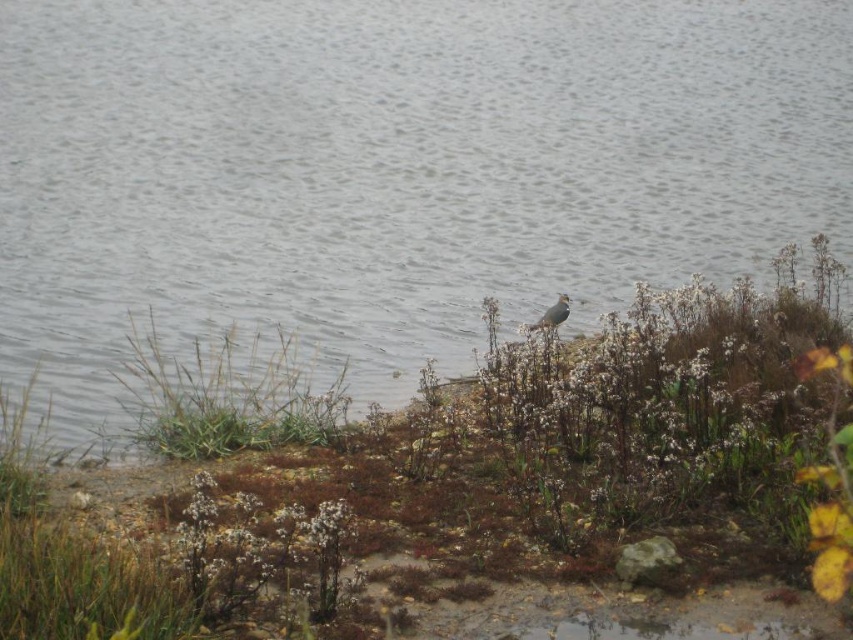
Question: Can you confirm if gray water at center is smaller than gray matte bird at center?

Choices:
 (A) no
 (B) yes

Answer: (A)

Question: Which object is closer to the camera taking this photo?

Choices:
 (A) gray water at center
 (B) brown grass at center

Answer: (B)

Question: Which point is closer to the camera?

Choices:
 (A) (544, 564)
 (B) (547, 326)

Answer: (A)

Question: Estimate the real-world distances between objects in this image. Which object is farther from the gray water at center?

Choices:
 (A) gray matte bird at center
 (B) brown grass at center

Answer: (A)

Question: Can you confirm if gray water at center is bigger than brown grass at center?

Choices:
 (A) no
 (B) yes

Answer: (B)

Question: Is brown grass at center above gray matte bird at center?

Choices:
 (A) no
 (B) yes

Answer: (A)